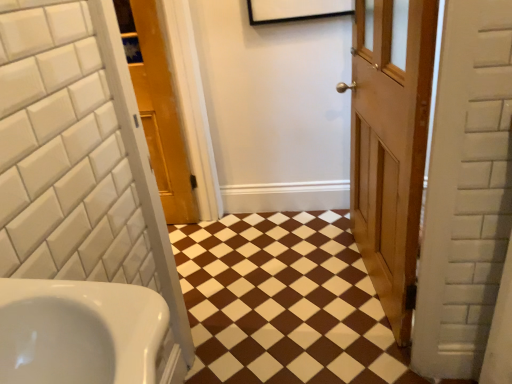
Question: Does wooden door at center, which ranks as the 2th door in left-to-right order, have a greater width compared to brown glossy tile at center?

Choices:
 (A) no
 (B) yes

Answer: (A)

Question: Considering the relative sizes of wooden door at center, which ranks as the 2th door in left-to-right order, and brown glossy tile at center in the image provided, is wooden door at center, which ranks as the 2th door in left-to-right order, smaller than brown glossy tile at center?

Choices:
 (A) no
 (B) yes

Answer: (A)

Question: Does wooden door at center, which ranks as the 2th door in left-to-right order, turn towards brown glossy tile at center?

Choices:
 (A) no
 (B) yes

Answer: (B)

Question: From a real-world perspective, is wooden door at center, which ranks as the 2th door in left-to-right order, located higher than brown glossy tile at center?

Choices:
 (A) yes
 (B) no

Answer: (A)

Question: From the image's perspective, is wooden door at center, which ranks as the 2th door in left-to-right order, on brown glossy tile at center?

Choices:
 (A) yes
 (B) no

Answer: (A)

Question: From a real-world perspective, does wooden door at center, which ranks as the 2th door in left-to-right order, sit lower than brown glossy tile at center?

Choices:
 (A) yes
 (B) no

Answer: (B)

Question: From a real-world perspective, is wooden door at center, the 1th door when ordered from right to left, physically below wooden door at center, which ranks as the second door in right-to-left order?

Choices:
 (A) yes
 (B) no

Answer: (A)

Question: Could you tell me if wooden door at center, which ranks as the 2th door in left-to-right order, is turned towards wooden door at center, which ranks as the second door in right-to-left order?

Choices:
 (A) yes
 (B) no

Answer: (A)

Question: Is wooden door at center, which ranks as the 2th door in left-to-right order, taller than wooden door at center, which ranks as the second door in right-to-left order?

Choices:
 (A) no
 (B) yes

Answer: (A)

Question: Is wooden door at center, the 1th door when ordered from right to left, to the left of wooden door at center, the 1th door from the left, from the viewer's perspective?

Choices:
 (A) no
 (B) yes

Answer: (A)

Question: Would you consider wooden door at center, which ranks as the 2th door in left-to-right order, to be distant from wooden door at center, which ranks as the second door in right-to-left order?

Choices:
 (A) no
 (B) yes

Answer: (B)

Question: Does wooden door at center, which ranks as the 2th door in left-to-right order, touch wooden door at center, which ranks as the second door in right-to-left order?

Choices:
 (A) no
 (B) yes

Answer: (A)

Question: Does wooden door at center, the 1th door from the left, contain white glossy sink at lower left?

Choices:
 (A) no
 (B) yes

Answer: (A)